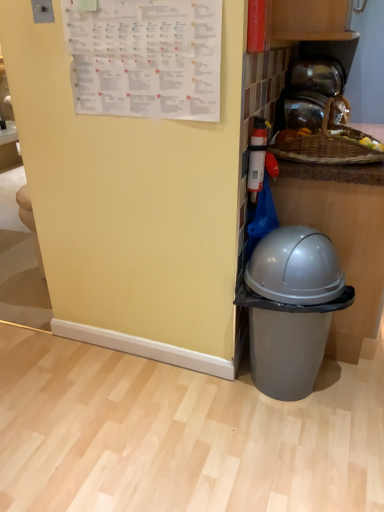
Locate an element on the screen. vacant space in gray plastic trash can at lower right (from a real-world perspective) is located at coordinates (292, 400).